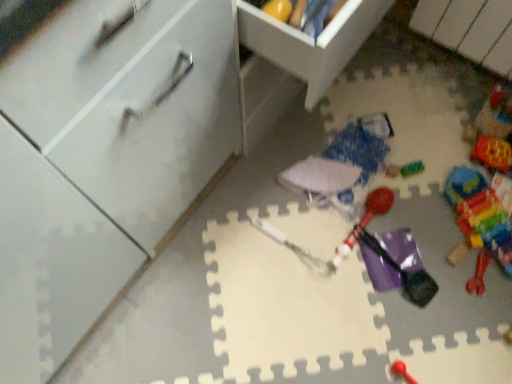
Question: Is white matte cabinet at left, which is the first cabinetry from left to right, at the back of translucent plastic blocks at lower right, the first toy viewed from the right?

Choices:
 (A) yes
 (B) no

Answer: (B)

Question: From the image's perspective, is translucent plastic blocks at lower right, the first toy viewed from the right, under white matte cabinet at left, which is the second cabinetry in right-to-left order?

Choices:
 (A) yes
 (B) no

Answer: (A)

Question: Is the position of translucent plastic blocks at lower right, the first toy viewed from the right, more distant than that of white matte cabinet at left, which is the first cabinetry from left to right?

Choices:
 (A) yes
 (B) no

Answer: (A)

Question: Considering the relative sizes of translucent plastic blocks at lower right, acting as the 7th toy starting from the left, and white matte cabinet at left, which is the first cabinetry from left to right, in the image provided, is translucent plastic blocks at lower right, acting as the 7th toy starting from the left, shorter than white matte cabinet at left, which is the first cabinetry from left to right,?

Choices:
 (A) no
 (B) yes

Answer: (B)

Question: Is translucent plastic blocks at lower right, the first toy viewed from the right, wider than white matte cabinet at left, which is the first cabinetry from left to right?

Choices:
 (A) yes
 (B) no

Answer: (B)

Question: From the image's perspective, is translucent plastic blocks at lower right, the first toy viewed from the right, over white matte cabinet at left, which is the first cabinetry from left to right?

Choices:
 (A) no
 (B) yes

Answer: (A)

Question: Can you confirm if multicolored plastic blocks at right, which is the 2th toy in right-to-left order, is thinner than translucent plastic blocks at lower right, acting as the 7th toy starting from the left?

Choices:
 (A) yes
 (B) no

Answer: (B)

Question: From a real-world perspective, does multicolored plastic blocks at right, acting as the 6th toy starting from the left, stand above translucent plastic blocks at lower right, the first toy viewed from the right?

Choices:
 (A) yes
 (B) no

Answer: (A)

Question: Would you say multicolored plastic blocks at right, which is the 2th toy in right-to-left order, contains translucent plastic blocks at lower right, acting as the 7th toy starting from the left?

Choices:
 (A) no
 (B) yes

Answer: (B)

Question: Is multicolored plastic blocks at right, which is the 2th toy in right-to-left order, looking in the opposite direction of translucent plastic blocks at lower right, acting as the 7th toy starting from the left?

Choices:
 (A) yes
 (B) no

Answer: (A)

Question: From a real-world perspective, is multicolored plastic blocks at right, which is the 2th toy in right-to-left order, located beneath translucent plastic blocks at lower right, the first toy viewed from the right?

Choices:
 (A) no
 (B) yes

Answer: (A)

Question: Is multicolored plastic blocks at right, acting as the 6th toy starting from the left, shorter than translucent plastic blocks at lower right, acting as the 7th toy starting from the left?

Choices:
 (A) yes
 (B) no

Answer: (B)

Question: Is translucent plastic blocks at lower right, acting as the 7th toy starting from the left, bigger than rubberized red mallet at center, the sixth toy in the right-to-left sequence?

Choices:
 (A) no
 (B) yes

Answer: (A)